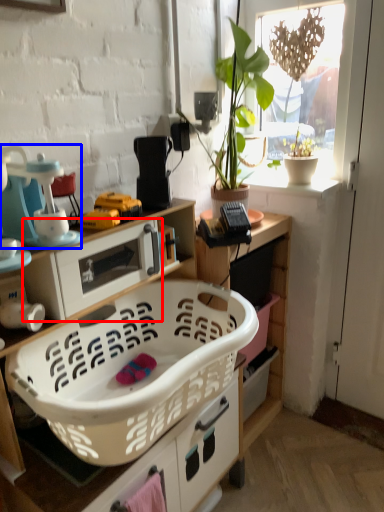
Question: Which object is further to the camera taking this photo, appliance (highlighted by a red box) or appliance (highlighted by a blue box)?

Choices:
 (A) appliance
 (B) appliance

Answer: (A)